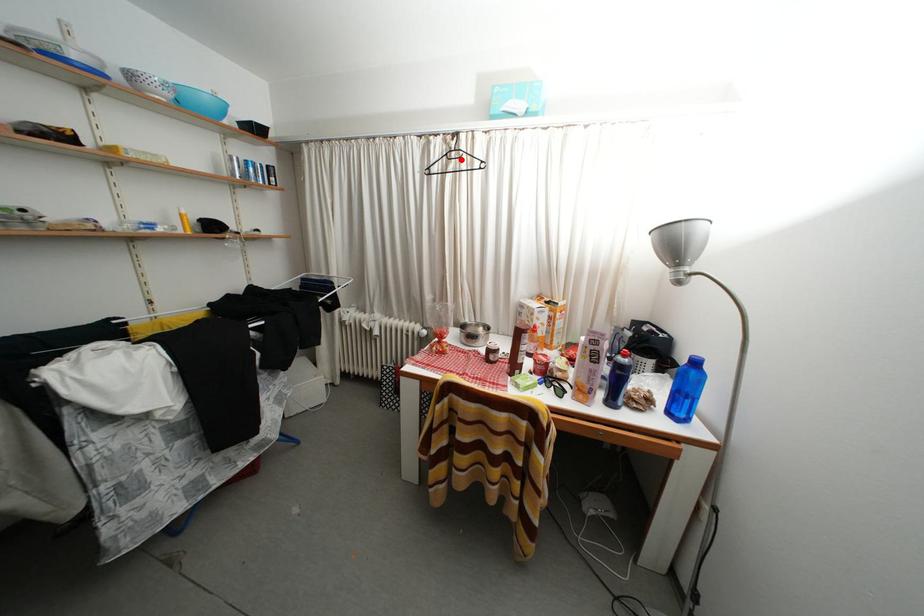
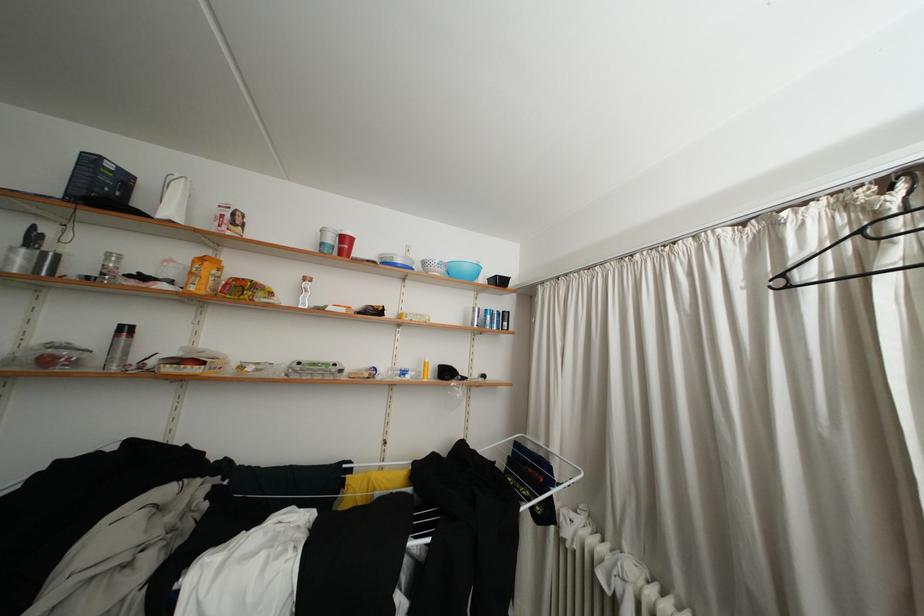
Locate, in the second image, the point that corresponds to the highlighted location in the first image.

(906, 229)